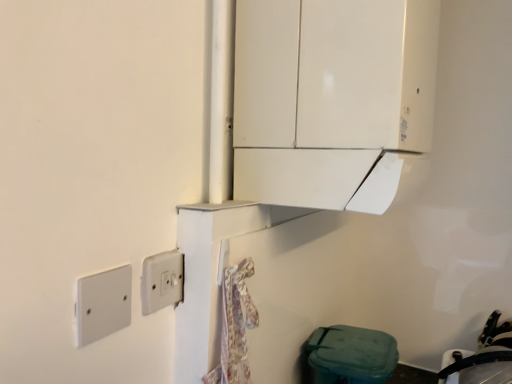
Question: Is black rubber sink at lower right further to the viewer compared to white plastic/light switch at lower left, which ranks as the 1th light switch in front-to-back order?

Choices:
 (A) yes
 (B) no

Answer: (A)

Question: Is black rubber sink at lower right far away from white plastic/light switch at lower left, the first light switch viewed from the left?

Choices:
 (A) yes
 (B) no

Answer: (B)

Question: Is black rubber sink at lower right oriented away from white plastic/light switch at lower left, which ranks as the 1th light switch in front-to-back order?

Choices:
 (A) no
 (B) yes

Answer: (A)

Question: Are black rubber sink at lower right and white plastic/light switch at lower left, which ranks as the 1th light switch in front-to-back order, making contact?

Choices:
 (A) yes
 (B) no

Answer: (B)

Question: Does black rubber sink at lower right lie in front of white plastic/light switch at lower left, which ranks as the 1th light switch in front-to-back order?

Choices:
 (A) yes
 (B) no

Answer: (B)

Question: Does point (286, 165) appear closer or farther from the camera than point (471, 377)?

Choices:
 (A) closer
 (B) farther

Answer: (A)

Question: From a real-world perspective, relative to black rubber sink at lower right, is white glossy cabinet at upper center vertically above or below?

Choices:
 (A) above
 (B) below

Answer: (A)

Question: From the image's perspective, is white glossy cabinet at upper center located above or below black rubber sink at lower right?

Choices:
 (A) below
 (B) above

Answer: (B)

Question: Considering the positions of white glossy cabinet at upper center and black rubber sink at lower right in the image, is white glossy cabinet at upper center wider or thinner than black rubber sink at lower right?

Choices:
 (A) thin
 (B) wide

Answer: (B)

Question: In terms of height, does white plastic/light switch at lower left, which ranks as the 1th light switch in front-to-back order, look taller or shorter compared to white glossy cabinet at upper center?

Choices:
 (A) tall
 (B) short

Answer: (B)

Question: Considering their positions, is white plastic/light switch at lower left, positioned as the second light switch in back-to-front order, located in front of or behind white glossy cabinet at upper center?

Choices:
 (A) behind
 (B) front

Answer: (B)

Question: From the image's perspective, is white plastic/light switch at lower left, the first light switch viewed from the left, located above or below white glossy cabinet at upper center?

Choices:
 (A) above
 (B) below

Answer: (B)

Question: Do you think white plastic/light switch at lower left, the first light switch viewed from the left, is within white glossy cabinet at upper center, or outside of it?

Choices:
 (A) inside
 (B) outside

Answer: (B)

Question: From the image's perspective, is white plastic light switch at center, acting as the second light switch starting from the left, located above or below black rubber sink at lower right?

Choices:
 (A) above
 (B) below

Answer: (A)

Question: Considering the positions of point (160, 301) and point (500, 336), is point (160, 301) closer or farther from the camera than point (500, 336)?

Choices:
 (A) closer
 (B) farther

Answer: (A)